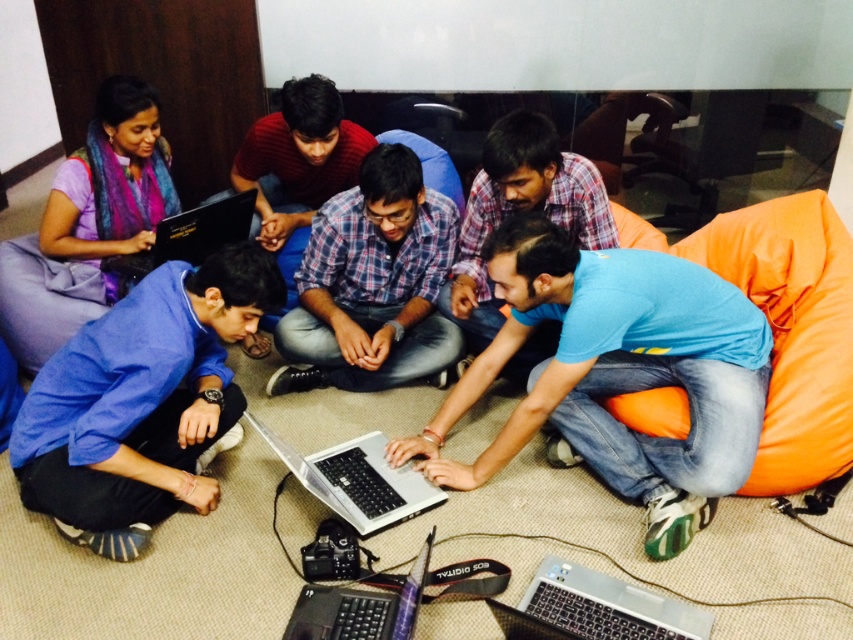
You are a person who wants to join the group around the laptop. The group is currently centered around the point at coordinates point (618,372). Where should you sit to be closest to the group?

The point (618,372) corresponds to the blue matte shirt at center, so you should sit near the blue matte shirt at center to be closest to the group.

You are standing in the room and want to reach both the point at coordinates point (392, 180) and point (521, 634). Which point will you reach first?

You will reach point (392, 180) first because it is closer to you than point (521, 634).

You are a photographer trying to capture a group photo of the blue matte shirt at center and the silver metallic laptop at lower center. If you want to ensure both subjects are fully visible in the frame, which subject requires a wider angle to accommodate its size?

The blue matte shirt at center requires a wider angle because its width surpasses that of the silver metallic laptop at lower center, necessitating more space in the frame to capture it fully.